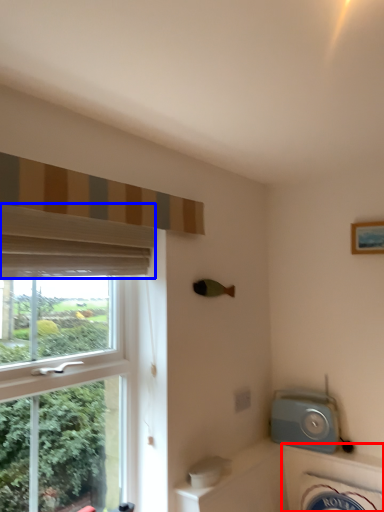
Question: Which point is closer to the camera, bath (highlighted by a red box) or curtain (highlighted by a blue box)?

Choices:
 (A) bath
 (B) curtain

Answer: (B)